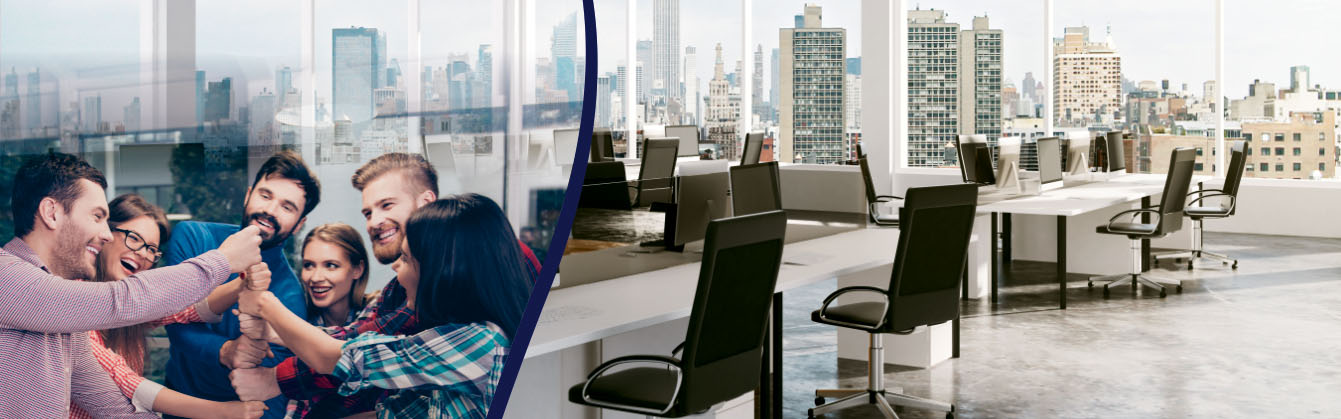
At what (x,y) coordinates should I click in order to perform the action: click on monitors. Please return your answer as a coordinate pair (x, y). The width and height of the screenshot is (1341, 419). Looking at the image, I should click on (754, 191), (696, 206), (679, 137), (700, 167), (1045, 166), (1002, 156), (1075, 148), (1112, 157).